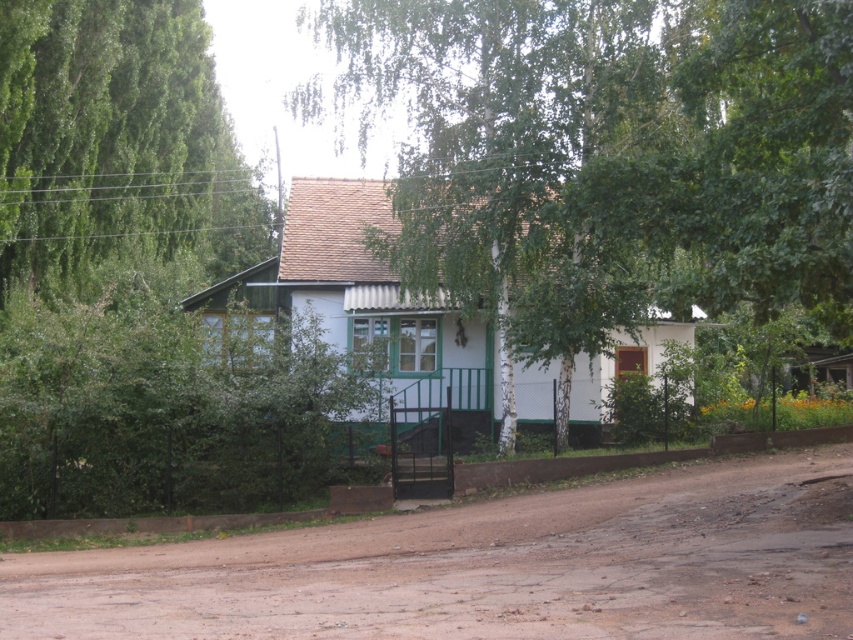
Question: Which of the following is the closest to the observer?

Choices:
 (A) green bark tree at center
 (B) brown dirt track at center

Answer: (B)

Question: Is the position of green bark tree at center less distant than that of brown dirt track at center?

Choices:
 (A) yes
 (B) no

Answer: (B)

Question: Is green bark tree at center wider than brown dirt track at center?

Choices:
 (A) yes
 (B) no

Answer: (A)

Question: Which point is farther from the camera taking this photo?

Choices:
 (A) (527, 90)
 (B) (431, 593)

Answer: (A)

Question: Is green bark tree at center smaller than brown dirt track at center?

Choices:
 (A) no
 (B) yes

Answer: (A)